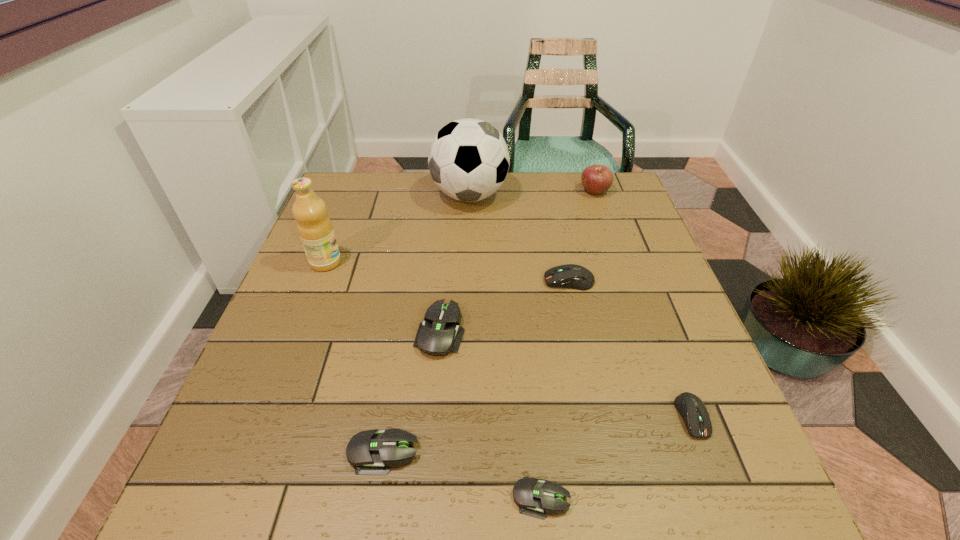
You are a GUI agent. You are given a task and a screenshot of the screen. Output one action in this format:
    pyautogui.click(x=<x>, y=<y>)
    Task: Click on the black soccer ball
    This screenshot has width=960, height=540.
    Given the screenshot: What is the action you would take?
    pyautogui.click(x=468, y=160)

This screenshot has width=960, height=540. I want to click on the leftmost object, so click(315, 229).

Image resolution: width=960 pixels, height=540 pixels. I want to click on apple, so click(x=597, y=179).

Identify the location of the farthest computer mouse. The image size is (960, 540). (x=572, y=276).

Locate an element on the screen. The height and width of the screenshot is (540, 960). the farther dark computer equipment is located at coordinates (572, 276).

Find the location of a particular element. The width and height of the screenshot is (960, 540). the fourth nearest object is located at coordinates (439, 333).

Where is `the biggest gray computer mouse`? The image size is (960, 540). the biggest gray computer mouse is located at coordinates (439, 333).

Where is `the rightmost computer mouse`? This screenshot has width=960, height=540. the rightmost computer mouse is located at coordinates (693, 411).

Locate an element on the screen. The height and width of the screenshot is (540, 960). the smaller dark computer equipment is located at coordinates (693, 411).

Where is `the second nearest gray computer mouse`? the second nearest gray computer mouse is located at coordinates (370, 451).